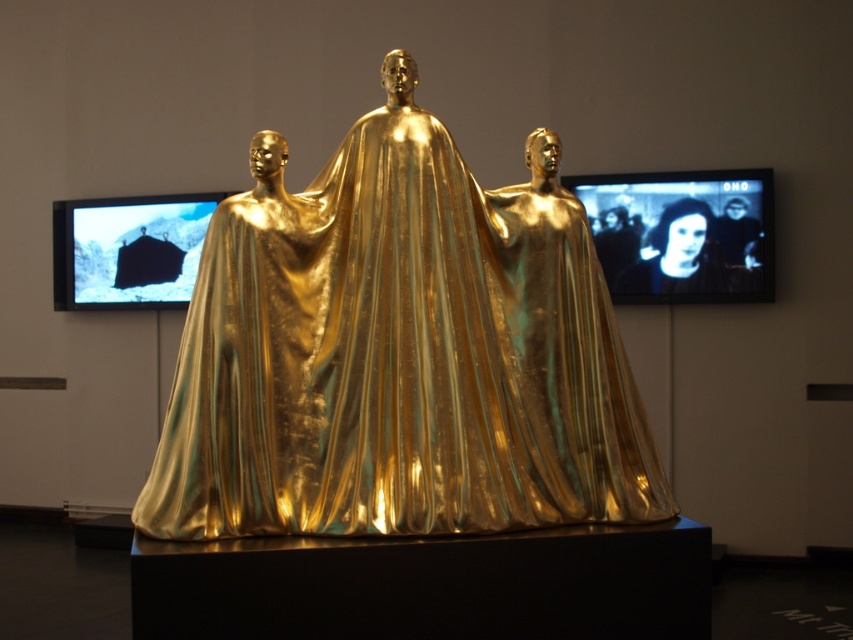
Is smooth black face at upper center to the left of smooth black face at upper right from the viewer's perspective?

Yes, smooth black face at upper center is to the left of smooth black face at upper right.

Who is taller, smooth black face at upper center or smooth black face at upper right?

smooth black face at upper center

Is point (659, 262) positioned before point (740, 212)?

No, it is not.

Find the location of a particular element. smooth black face at upper center is located at coordinates (679, 256).

Is point (306, 324) farther from camera compared to point (730, 211)?

That is False.

Can you confirm if gold metallic cape at center is wider than smooth black face at upper right?

Yes, gold metallic cape at center is wider than smooth black face at upper right.

Identify the location of gold metallic cape at center. (399, 353).

You are a GUI agent. You are given a task and a screenshot of the screen. Output one action in this format:
    pyautogui.click(x=<x>, y=<y>)
    Task: Click on the gold metallic cape at center
    
    Given the screenshot: What is the action you would take?
    pyautogui.click(x=399, y=353)

Who is higher up, gold metallic cape at center or black glossy face at upper center?

black glossy face at upper center is higher up.

Can you confirm if gold metallic cape at center is bigger than black glossy face at upper center?

Correct, gold metallic cape at center is larger in size than black glossy face at upper center.

You are a GUI agent. You are given a task and a screenshot of the screen. Output one action in this format:
    pyautogui.click(x=<x>, y=<y>)
    Task: Click on the gold metallic cape at center
    This screenshot has width=853, height=640.
    Given the screenshot: What is the action you would take?
    pyautogui.click(x=399, y=353)